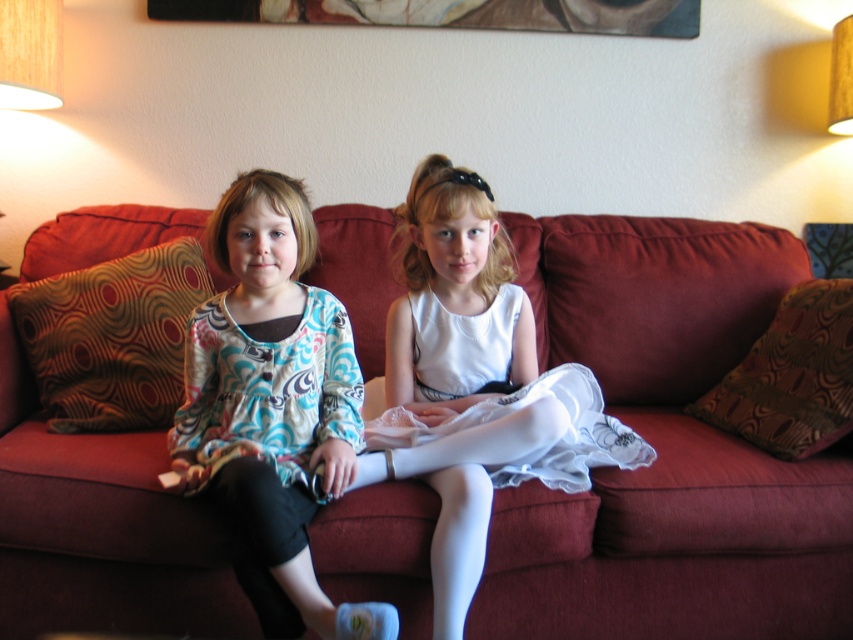
You are a guest in this living room and want to place a new decorative item between the white satin dress at center and the wooden picture frame at upper center. Which object should you place it closer to so that it stays centered between them?

You should place the new decorative item closer to the wooden picture frame at upper center because the white satin dress at center is located to the right of the wooden picture frame at upper center, so the midpoint between them would be closer to the frame.

You are standing in the living room and want to place a small decorative item on the closest surface to you. Which object between the velvet red couch at center and the wooden picture frame at upper center should you choose?

The velvet red couch at center is closer to the viewer than the wooden picture frame at upper center, so you should place the decorative item on the velvet red couch at center.